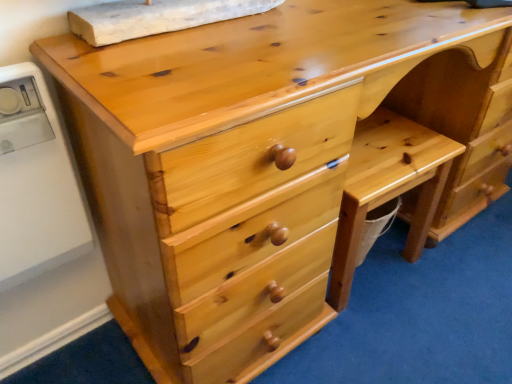
Where is `spots to the right of natural wood chair at lower right`? spots to the right of natural wood chair at lower right is located at coordinates (460, 279).